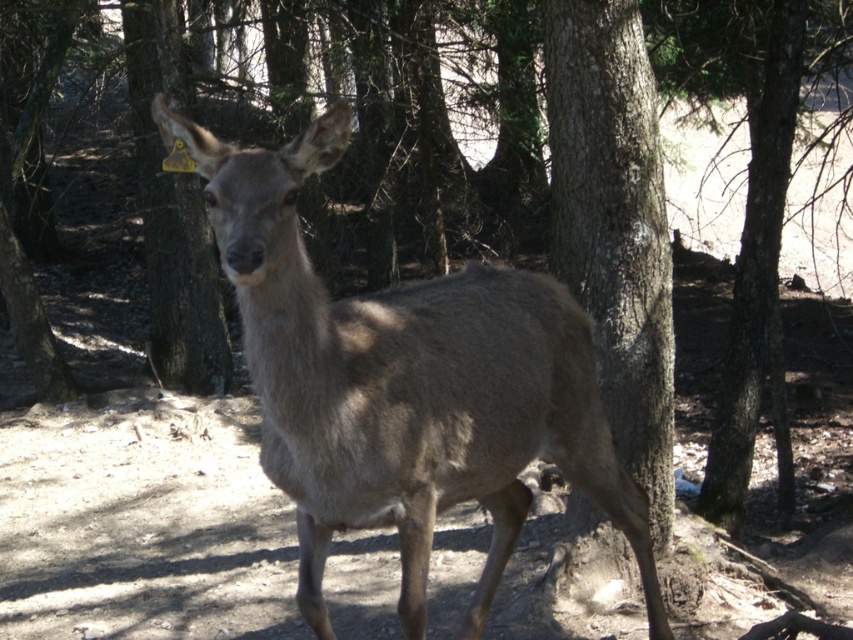
Is the position of gray fur deer at center more distant than that of rough bark tree at center?

No.

Locate an element on the screen. The height and width of the screenshot is (640, 853). gray fur deer at center is located at coordinates (403, 384).

Is point (361, 358) less distant than point (625, 177)?

Yes.

This screenshot has width=853, height=640. What are the coordinates of `gray fur deer at center` in the screenshot? It's located at (403, 384).